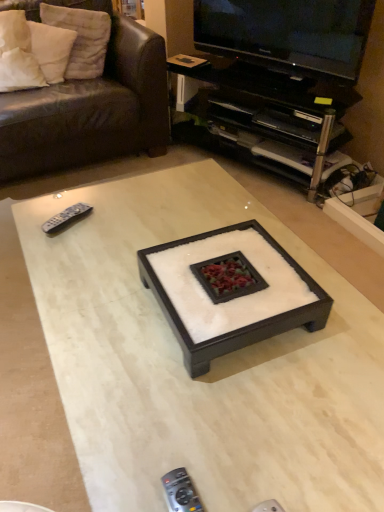
Measure the distance between white felt square tray at center, positioned as the first coffee table in top-to-bottom order, and camera.

The distance of white felt square tray at center, positioned as the first coffee table in top-to-bottom order, from camera is 92.88 centimeters.

The image size is (384, 512). I want to click on white felt square tray at center, positioned as the first coffee table in top-to-bottom order, so click(230, 291).

What is the approximate height of white soft pillow at upper left, the first pillow in the left-to-right sequence?

It is 11.00 inches.

Describe the element at coordinates (212, 362) in the screenshot. This screenshot has width=384, height=512. I see `white marble coffee table at center, the first coffee table when ordered from bottom to top` at that location.

Where is `white felt square tray at center, the 2th coffee table positioned from the bottom`? This screenshot has height=512, width=384. white felt square tray at center, the 2th coffee table positioned from the bottom is located at coordinates (230, 291).

Measure the distance from leather couch at upper left to white cotton pillow at upper left, the second pillow in the left-to-right sequence.

leather couch at upper left and white cotton pillow at upper left, the second pillow in the left-to-right sequence, are 11.17 inches apart from each other.

Is leather couch at upper left in front of or behind white cotton pillow at upper left, placed as the 1th pillow when sorted from right to left, in the image?

leather couch at upper left is positioned closer to the viewer than white cotton pillow at upper left, placed as the 1th pillow when sorted from right to left.

Considering the relative sizes of leather couch at upper left and white cotton pillow at upper left, placed as the 1th pillow when sorted from right to left, in the image provided, is leather couch at upper left taller than white cotton pillow at upper left, placed as the 1th pillow when sorted from right to left,?

Correct, leather couch at upper left is much taller as white cotton pillow at upper left, placed as the 1th pillow when sorted from right to left.

From a real-world perspective, who is located higher, leather couch at upper left or white cotton pillow at upper left, placed as the 1th pillow when sorted from right to left?

From a 3D spatial view, white cotton pillow at upper left, placed as the 1th pillow when sorted from right to left, is above.

Considering the sizes of objects white soft pillow at upper left, the second pillow when ordered from right to left, and leather couch at upper left in the image provided, who is bigger, white soft pillow at upper left, the second pillow when ordered from right to left, or leather couch at upper left?

With larger size is leather couch at upper left.

I want to click on pillow lying on the left of leather couch at upper left, so click(51, 49).

From a real-world perspective, is white soft pillow at upper left, the second pillow when ordered from right to left, located higher than leather couch at upper left?

Yes.

Is white soft pillow at upper left, the first pillow in the left-to-right sequence, taller or shorter than leather couch at upper left?

In the image, white soft pillow at upper left, the first pillow in the left-to-right sequence, appears to be shorter than leather couch at upper left.

Could you tell me if black plastic tv stand at upper right is turned towards white soft pillow at upper left, the second pillow when ordered from right to left?

No, black plastic tv stand at upper right is not facing towards white soft pillow at upper left, the second pillow when ordered from right to left.

What's the angular difference between black plastic tv stand at upper right and white soft pillow at upper left, the first pillow in the left-to-right sequence,'s facing directions?

The angular difference between black plastic tv stand at upper right and white soft pillow at upper left, the first pillow in the left-to-right sequence, is 29.9 degrees.

Based on the photo, is black plastic tv stand at upper right wider or thinner than white soft pillow at upper left, the first pillow in the left-to-right sequence?

In the image, black plastic tv stand at upper right appears to be wider than white soft pillow at upper left, the first pillow in the left-to-right sequence.

Starting from the black plastic tv stand at upper right, which pillow is the 1st one behind? Please provide its 2D coordinates.

[(51, 49)]

Is point (244, 53) closer to camera compared to point (167, 494)?

No, (244, 53) is further to viewer.

How many degrees apart are the facing directions of black glossy television at upper right and black plastic remote control at lower center, placed as the 1th remote control when sorted from front to back?

They differ by 21.7 degrees in their facing directions.

Does black glossy television at upper right have a greater height compared to black plastic remote control at lower center, which is the second remote control from back to front?

Yes.

Is black glossy television at upper right looking in the opposite direction of black plastic remote control at lower center, placed as the 1th remote control when sorted from front to back?

black glossy television at upper right does not have its back to black plastic remote control at lower center, placed as the 1th remote control when sorted from front to back.

In the scene shown: Could you tell me if black glossy television at upper right is turned towards white marble coffee table at center, positioned as the 2th coffee table in top-to-bottom order?

Yes, black glossy television at upper right faces towards white marble coffee table at center, positioned as the 2th coffee table in top-to-bottom order.

From a real-world perspective, is black glossy television at upper right physically located above or below white marble coffee table at center, the first coffee table when ordered from bottom to top?

From a real-world perspective, black glossy television at upper right is physically above white marble coffee table at center, the first coffee table when ordered from bottom to top.

From the image's perspective, between black glossy television at upper right and white marble coffee table at center, the first coffee table when ordered from bottom to top, which one is located above?

black glossy television at upper right.

Is black glossy television at upper right positioned behind white marble coffee table at center, positioned as the 2th coffee table in top-to-bottom order?

Yes, it is behind white marble coffee table at center, positioned as the 2th coffee table in top-to-bottom order.

From the image's perspective, between white soft pillow at upper left, the second pillow when ordered from right to left, and white felt square tray at center, the 2th coffee table positioned from the bottom, which one is located above?

From the image's view, white soft pillow at upper left, the second pillow when ordered from right to left, is above.

Which point is more forward, [57,74] or [325,306]?

The point [325,306] is closer to the camera.

Is white soft pillow at upper left, the second pillow when ordered from right to left, far away from white felt square tray at center, the 2th coffee table positioned from the bottom?

white soft pillow at upper left, the second pillow when ordered from right to left, is positioned a significant distance from white felt square tray at center, the 2th coffee table positioned from the bottom.

Is white felt square tray at center, the 2th coffee table positioned from the bottom, inside the boundaries of gray plastic remote at left, the second remote control from the right, or outside?

The correct answer is: outside.

Which is more to the left, white felt square tray at center, the 2th coffee table positioned from the bottom, or gray plastic remote at left, the first remote control viewed from the left?

gray plastic remote at left, the first remote control viewed from the left.

Between white felt square tray at center, positioned as the first coffee table in top-to-bottom order, and gray plastic remote at left, marked as the first remote control in a top-to-bottom arrangement, which one has smaller width?

gray plastic remote at left, marked as the first remote control in a top-to-bottom arrangement.

Is point (238, 277) closer or farther from the camera than point (61, 224)?

Point (238, 277) is positioned closer to the camera compared to point (61, 224).

This screenshot has width=384, height=512. Find the location of `the 2nd pillow above the leather couch at upper left (from the image's perspective)`. the 2nd pillow above the leather couch at upper left (from the image's perspective) is located at coordinates point(81,38).

Where is `studio couch that is under the white soft pillow at upper left, the first pillow in the left-to-right sequence (from a real-world perspective)`? studio couch that is under the white soft pillow at upper left, the first pillow in the left-to-right sequence (from a real-world perspective) is located at coordinates (90, 108).

When comparing their distances from white soft pillow at upper left, the second pillow when ordered from right to left, does leather couch at upper left or white felt square tray at center, positioned as the first coffee table in top-to-bottom order, seem further?

Based on the image, white felt square tray at center, positioned as the first coffee table in top-to-bottom order, appears to be further to white soft pillow at upper left, the second pillow when ordered from right to left.

When comparing their distances from gray plastic remote at left, the 2th remote control ordered from the bottom, does black glossy television at upper right or black plastic tv stand at upper right seem further?

Among the two, black glossy television at upper right is located further to gray plastic remote at left, the 2th remote control ordered from the bottom.

Estimate the real-world distances between objects in this image. Which object is further from white soft pillow at upper left, the first pillow in the left-to-right sequence, gray plastic remote at left, acting as the 2th remote control starting from the front, or black glossy television at upper right?

Among the two, gray plastic remote at left, acting as the 2th remote control starting from the front, is located further to white soft pillow at upper left, the first pillow in the left-to-right sequence.

Looking at the image, which one is located closer to black plastic tv stand at upper right, black plastic remote control at lower center, the 2th remote control from the left, or white felt square tray at center, the 2th coffee table positioned from the bottom?

The object closer to black plastic tv stand at upper right is white felt square tray at center, the 2th coffee table positioned from the bottom.

Considering their positions, is white marble coffee table at center, positioned as the 2th coffee table in top-to-bottom order, positioned closer to black plastic tv stand at upper right than leather couch at upper left?

leather couch at upper left is closer to black plastic tv stand at upper right.

Estimate the real-world distances between objects in this image. Which object is further from white felt square tray at center, the 2th coffee table positioned from the bottom, white soft pillow at upper left, the second pillow when ordered from right to left, or black plastic tv stand at upper right?

white soft pillow at upper left, the second pillow when ordered from right to left, lies further to white felt square tray at center, the 2th coffee table positioned from the bottom, than the other object.

From the image, which object appears to be farther from black plastic remote control at lower center, the 2th remote control from the left, leather couch at upper left or white marble coffee table at center, the first coffee table when ordered from bottom to top?

Among the two, leather couch at upper left is located further to black plastic remote control at lower center, the 2th remote control from the left.

When comparing their distances from black glossy television at upper right, does black plastic tv stand at upper right or leather couch at upper left seem closer?

black plastic tv stand at upper right is closer to black glossy television at upper right.

This screenshot has width=384, height=512. In order to click on coffee table between black glossy television at upper right and white marble coffee table at center, the first coffee table when ordered from bottom to top, in the up-down direction in this screenshot , I will do `click(230, 291)`.

Find the location of a particular element. This screenshot has height=512, width=384. desk between white cotton pillow at upper left, placed as the 1th pillow when sorted from right to left, and black glossy television at upper right from left to right is located at coordinates point(268,113).

You are a GUI agent. You are given a task and a screenshot of the screen. Output one action in this format:
    pyautogui.click(x=<x>, y=<y>)
    Task: Click on the desk between black plastic remote control at lower center, the 2th remote control from the left, and white soft pillow at upper left, the first pillow in the left-to-right sequence, from front to back
    This screenshot has height=512, width=384.
    Given the screenshot: What is the action you would take?
    pyautogui.click(x=268, y=113)

The image size is (384, 512). In order to click on television between white cotton pillow at upper left, placed as the 1th pillow when sorted from right to left, and white felt square tray at center, positioned as the first coffee table in top-to-bottom order, in the vertical direction in this screenshot , I will do `click(288, 34)`.